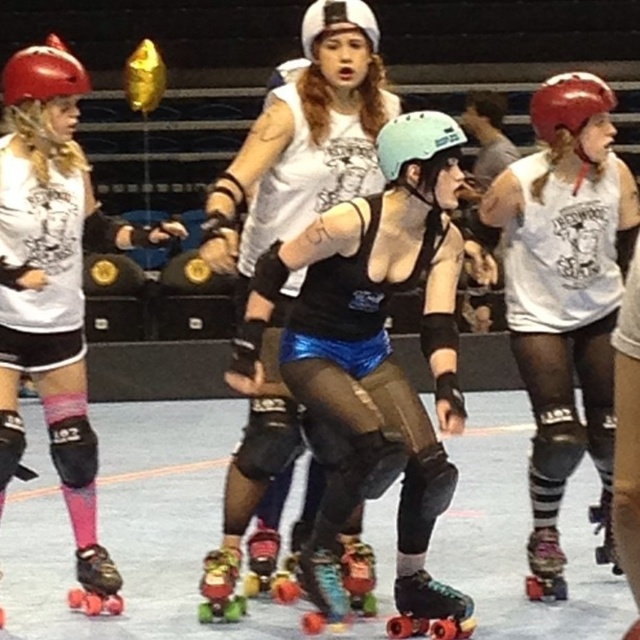
How much distance is there between black matte knee pad at lower left and shiny green roller skate at center?

The distance of black matte knee pad at lower left from shiny green roller skate at center is 5.05 feet.

Who is more forward, (76, 436) or (364, 589)?

Positioned in front is point (364, 589).

Is point (52, 442) closer to camera compared to point (358, 611)?

That is True.

You are a GUI agent. You are given a task and a screenshot of the screen. Output one action in this format:
    pyautogui.click(x=<x>, y=<y>)
    Task: Click on the black matte knee pad at lower left
    This screenshot has height=640, width=640.
    Given the screenshot: What is the action you would take?
    pyautogui.click(x=74, y=451)

Does point (600, 77) come in front of point (1, 611)?

No, it is behind (1, 611).

Is matte white tank top at center taller than brushed metal roller skate at lower left?

Correct, matte white tank top at center is much taller as brushed metal roller skate at lower left.

Image resolution: width=640 pixels, height=640 pixels. I want to click on matte white tank top at center, so click(564, 276).

Which is above, multicolored plastic roller skate at center or white matte helmet at upper center?

white matte helmet at upper center

What do you see at coordinates (268, 566) in the screenshot? I see `multicolored plastic roller skate at center` at bounding box center [268, 566].

Does point (276, 573) lie in front of point (314, 28)?

No, (276, 573) is behind (314, 28).

In order to click on multicolored plastic roller skate at center in this screenshot , I will do `click(268, 566)`.